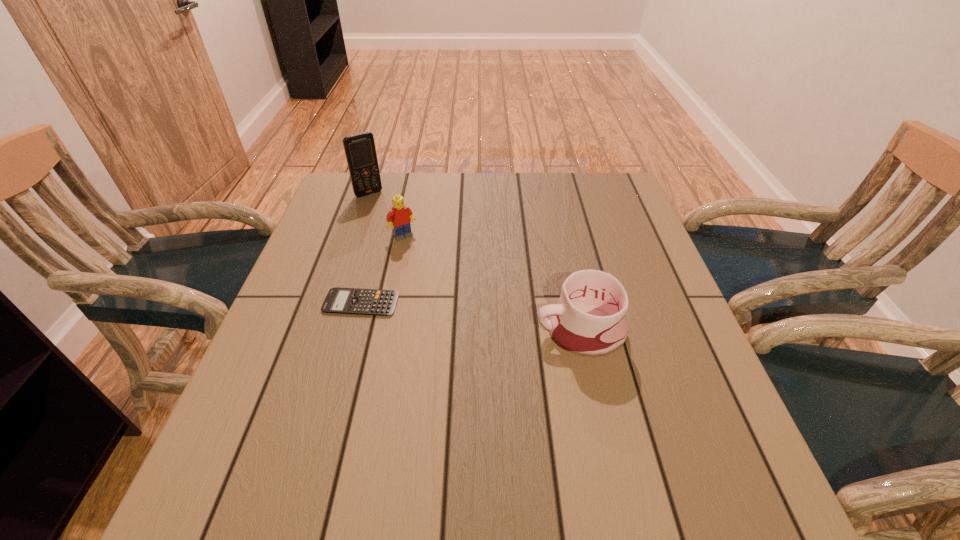
Where is `free region at the far edge of the desktop`? The image size is (960, 540). free region at the far edge of the desktop is located at coordinates (535, 179).

This screenshot has height=540, width=960. In the image, there is a desktop. In order to click on free region at the near edge in this screenshot , I will do `click(538, 435)`.

At what (x,y) coordinates should I click in order to perform the action: click on vacant area at the left edge. Please return your answer as a coordinate pair (x, y). The width and height of the screenshot is (960, 540). Looking at the image, I should click on (345, 241).

The height and width of the screenshot is (540, 960). Find the location of `free space at the right edge of the desktop`. free space at the right edge of the desktop is located at coordinates (686, 325).

Find the location of a particular element. The image size is (960, 540). vacant space at the far left corner of the desktop is located at coordinates (345, 213).

Where is `free location at the near left corner`? The image size is (960, 540). free location at the near left corner is located at coordinates (232, 419).

At what (x,y) coordinates should I click in order to perform the action: click on free point between the rightmost object and the second farthest object. Please return your answer as a coordinate pair (x, y). Looking at the image, I should click on (492, 284).

At what (x,y) coordinates should I click in order to perform the action: click on free space that is in between the Lego and the farthest object. Please return your answer as a coordinate pair (x, y). This screenshot has width=960, height=540. Looking at the image, I should click on (386, 215).

Locate an element on the screen. free space that is in between the second farthest object and the shortest object is located at coordinates (382, 269).

At what (x,y) coordinates should I click in order to perform the action: click on vacant space that's between the calculator and the Lego. Please return your answer as a coordinate pair (x, y). The width and height of the screenshot is (960, 540). Looking at the image, I should click on (382, 269).